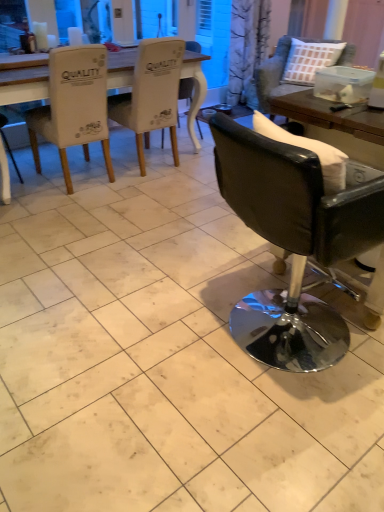
Identify the location of white fabric chair at center, which ranks as the 3th chair in right-to-left order. (193, 88).

Measure the distance between white fabric chair at center, the third chair when ordered from left to right, and camera.

white fabric chair at center, the third chair when ordered from left to right, is 10.55 feet from camera.

What is the approximate width of black leather chair at right, the fourth chair when ordered from left to right?

25.41 inches.

Describe the element at coordinates (269, 74) in the screenshot. I see `black leather chair at right, which ranks as the 1th chair in right-to-left order` at that location.

You are a GUI agent. You are given a task and a screenshot of the screen. Output one action in this format:
    pyautogui.click(x=<x>, y=<y>)
    Task: Click on the white fabric chair at center, the third chair when ordered from left to right
    
    Given the screenshot: What is the action you would take?
    pyautogui.click(x=193, y=88)

Based on the photo, considering the relative sizes of white fabric chair at upper left, the fifth chair viewed from the right, and white fabric chair at upper left, arranged as the 4th chair when viewed from the right, in the image provided, is white fabric chair at upper left, the fifth chair viewed from the right, shorter than white fabric chair at upper left, arranged as the 4th chair when viewed from the right,?

Correct, white fabric chair at upper left, the fifth chair viewed from the right, is not as tall as white fabric chair at upper left, arranged as the 4th chair when viewed from the right.

Is point (43, 106) behind point (148, 60)?

Yes.

Based on the photo, is white fabric chair at upper left, the fifth chair viewed from the right, positioned far away from white fabric chair at upper left, arranged as the 4th chair when viewed from the right?

white fabric chair at upper left, the fifth chair viewed from the right, is actually quite close to white fabric chair at upper left, arranged as the 4th chair when viewed from the right.

Is white fabric chair at center, the third chair when ordered from left to right, outside of white fabric table at upper left?

white fabric chair at center, the third chair when ordered from left to right, lies outside white fabric table at upper left's area.

From the image's perspective, who appears lower, white fabric chair at center, the third chair when ordered from left to right, or white fabric table at upper left?

white fabric chair at center, the third chair when ordered from left to right.

Between white fabric chair at center, which ranks as the 3th chair in right-to-left order, and white fabric table at upper left, which one appears on the left side from the viewer's perspective?

From the viewer's perspective, white fabric table at upper left appears more on the left side.

Considering the positions of points (194, 134) and (107, 87), is point (194, 134) farther from camera compared to point (107, 87)?

Yes.

In the image, is white fabric chair at upper left, arranged as the 4th chair when viewed from the right, positioned in front of or behind white fabric table at upper left?

white fabric chair at upper left, arranged as the 4th chair when viewed from the right, is positioned closer to the viewer than white fabric table at upper left.

How different are the orientations of white fabric chair at upper left, arranged as the 4th chair when viewed from the right, and white fabric table at upper left in degrees?

There is a 180-degree angle between the facing directions of white fabric chair at upper left, arranged as the 4th chair when viewed from the right, and white fabric table at upper left.

Considering the relative sizes of white fabric chair at center, which ranks as the 3th chair in right-to-left order, and black leather chair at right, which ranks as the 1th chair in right-to-left order, in the image provided, is white fabric chair at center, which ranks as the 3th chair in right-to-left order, shorter than black leather chair at right, which ranks as the 1th chair in right-to-left order,?

Correct, white fabric chair at center, which ranks as the 3th chair in right-to-left order, is not as tall as black leather chair at right, which ranks as the 1th chair in right-to-left order.

In the scene shown: Which object is positioned more to the right, white fabric chair at center, the third chair when ordered from left to right, or black leather chair at right, which ranks as the 1th chair in right-to-left order?

black leather chair at right, which ranks as the 1th chair in right-to-left order.

Is white fabric chair at center, the third chair when ordered from left to right, aimed at black leather chair at right, which ranks as the 1th chair in right-to-left order?

No, white fabric chair at center, the third chair when ordered from left to right, does not turn towards black leather chair at right, which ranks as the 1th chair in right-to-left order.

From the picture: Considering the relative sizes of white fabric chair at center, which ranks as the 3th chair in right-to-left order, and black leather chair at right, the 5th chair from the left, in the image provided, is white fabric chair at center, which ranks as the 3th chair in right-to-left order, smaller than black leather chair at right, the 5th chair from the left,?

Yes.

Are white fabric chair at upper left, which is counted as the second chair, starting from the left, and white fabric chair at upper left, the fifth chair viewed from the right, far apart?

white fabric chair at upper left, which is counted as the second chair, starting from the left, is near white fabric chair at upper left, the fifth chair viewed from the right, not far away.

Looking at this image, is white fabric chair at upper left, arranged as the 4th chair when viewed from the right, inside or outside of white fabric chair at upper left, the fifth chair viewed from the right?

white fabric chair at upper left, arranged as the 4th chair when viewed from the right, is outside white fabric chair at upper left, the fifth chair viewed from the right.

Is white fabric chair at upper left, arranged as the 4th chair when viewed from the right, looking in the opposite direction of white fabric chair at upper left, which ranks as the 1th chair in left-to-right order?

No, white fabric chair at upper left, arranged as the 4th chair when viewed from the right,'s orientation is not away from white fabric chair at upper left, which ranks as the 1th chair in left-to-right order.

From a real-world perspective, does white fabric chair at upper left, arranged as the 4th chair when viewed from the right, sit lower than white fabric chair at upper left, which ranks as the 1th chair in left-to-right order?

No, from a real-world perspective, white fabric chair at upper left, arranged as the 4th chair when viewed from the right, is not below white fabric chair at upper left, which ranks as the 1th chair in left-to-right order.

From a real-world perspective, which is physically above, black leather chair at right, acting as the 2th chair starting from the right, or white fabric chair at upper left, the fifth chair viewed from the right?

white fabric chair at upper left, the fifth chair viewed from the right, from a real-world perspective.

Would you say black leather chair at right, the fourth chair when ordered from left to right, is outside white fabric chair at upper left, the fifth chair viewed from the right?

Yes, black leather chair at right, the fourth chair when ordered from left to right, is outside of white fabric chair at upper left, the fifth chair viewed from the right.

From the image's perspective, is black leather chair at right, acting as the 2th chair starting from the right, positioned above or below white fabric chair at upper left, which ranks as the 1th chair in left-to-right order?

Clearly, from the image's perspective, black leather chair at right, acting as the 2th chair starting from the right, is below white fabric chair at upper left, which ranks as the 1th chair in left-to-right order.

Based on the photo, considering the relative sizes of black leather chair at right, acting as the 2th chair starting from the right, and white fabric chair at upper left, which ranks as the 1th chair in left-to-right order, in the image provided, is black leather chair at right, acting as the 2th chair starting from the right, taller than white fabric chair at upper left, which ranks as the 1th chair in left-to-right order,?

In fact, black leather chair at right, acting as the 2th chair starting from the right, may be shorter than white fabric chair at upper left, which ranks as the 1th chair in left-to-right order.

Which object is wider, black leather chair at right, the 5th chair from the left, or white fabric chair at upper left, which ranks as the 1th chair in left-to-right order?

Wider between the two is black leather chair at right, the 5th chair from the left.

From the image's perspective, is black leather chair at right, the 5th chair from the left, located above white fabric chair at upper left, the fifth chair viewed from the right?

Yes, from the image's perspective, black leather chair at right, the 5th chair from the left, is over white fabric chair at upper left, the fifth chair viewed from the right.

Can you tell me how much black leather chair at right, which ranks as the 1th chair in right-to-left order, and white fabric chair at upper left, which ranks as the 1th chair in left-to-right order, differ in facing direction?

112 degrees separate the facing orientations of black leather chair at right, which ranks as the 1th chair in right-to-left order, and white fabric chair at upper left, which ranks as the 1th chair in left-to-right order.

Consider the image. From a real-world perspective, does black leather chair at right, which ranks as the 1th chair in right-to-left order, stand above white fabric chair at upper left, the fifth chair viewed from the right?

No, from a real-world perspective, black leather chair at right, which ranks as the 1th chair in right-to-left order, is not above white fabric chair at upper left, the fifth chair viewed from the right.

Identify the location of chair located above the white fabric chair at upper left, the fifth chair viewed from the right (from a real-world perspective). The height and width of the screenshot is (512, 384). (152, 94).

Starting from the white fabric table at upper left, which chair is the 1st one behind? Please provide its 2D coordinates.

[(193, 88)]

Estimate the real-world distances between objects in this image. Which object is closer to white fabric chair at upper left, which is counted as the second chair, starting from the left, black leather chair at right, the fourth chair when ordered from left to right, or white fabric chair at center, which ranks as the 3th chair in right-to-left order?

white fabric chair at center, which ranks as the 3th chair in right-to-left order, is closer to white fabric chair at upper left, which is counted as the second chair, starting from the left.

Which object lies nearer to the anchor point white fabric chair at center, which ranks as the 3th chair in right-to-left order, black leather chair at right, the fourth chair when ordered from left to right, or white fabric chair at upper left, which ranks as the 1th chair in left-to-right order?

white fabric chair at upper left, which ranks as the 1th chair in left-to-right order, is positioned closer to the anchor white fabric chair at center, which ranks as the 3th chair in right-to-left order.

Based on their spatial positions, is black leather chair at right, which ranks as the 1th chair in right-to-left order, or white fabric chair at center, the third chair when ordered from left to right, closer to white fabric chair at upper left, which is counted as the second chair, starting from the left?

white fabric chair at center, the third chair when ordered from left to right.

From the image, which object appears to be farther from white fabric chair at center, the third chair when ordered from left to right, black leather chair at right, the fourth chair when ordered from left to right, or white fabric table at upper left?

Based on the image, black leather chair at right, the fourth chair when ordered from left to right, appears to be further to white fabric chair at center, the third chair when ordered from left to right.

Which object lies further to the anchor point black leather chair at right, the 5th chair from the left, white fabric chair at upper left, which ranks as the 1th chair in left-to-right order, or black leather chair at right, acting as the 2th chair starting from the right?

Based on the image, black leather chair at right, acting as the 2th chair starting from the right, appears to be further to black leather chair at right, the 5th chair from the left.

From the image, which object appears to be farther from black leather chair at right, the fourth chair when ordered from left to right, white fabric chair at center, the third chair when ordered from left to right, or white fabric chair at upper left, the fifth chair viewed from the right?

white fabric chair at center, the third chair when ordered from left to right, is further to black leather chair at right, the fourth chair when ordered from left to right.

Looking at the image, which one is located further to white fabric chair at upper left, arranged as the 4th chair when viewed from the right, white fabric chair at upper left, which ranks as the 1th chair in left-to-right order, or white fabric chair at center, the third chair when ordered from left to right?

The object further to white fabric chair at upper left, arranged as the 4th chair when viewed from the right, is white fabric chair at upper left, which ranks as the 1th chair in left-to-right order.

Considering their positions, is white fabric table at upper left positioned further to black leather chair at right, acting as the 2th chair starting from the right, than white fabric chair at upper left, the fifth chair viewed from the right?

white fabric table at upper left is further to black leather chair at right, acting as the 2th chair starting from the right.

Image resolution: width=384 pixels, height=512 pixels. Identify the location of chair between white fabric chair at upper left, the fifth chair viewed from the right, and white fabric chair at center, the third chair when ordered from left to right, along the z-axis. (152, 94).

The image size is (384, 512). In order to click on chair positioned between black leather chair at right, acting as the 2th chair starting from the right, and white fabric chair at upper left, which is counted as the second chair, starting from the left, from near to far in this screenshot , I will do `click(73, 106)`.

Locate an element on the screen. This screenshot has height=512, width=384. table positioned between white fabric chair at upper left, which ranks as the 1th chair in left-to-right order, and white fabric chair at center, the third chair when ordered from left to right, from near to far is located at coordinates (23, 84).

Find the location of `table between white fabric chair at upper left, the fifth chair viewed from the right, and black leather chair at right, which ranks as the 1th chair in right-to-left order`. table between white fabric chair at upper left, the fifth chair viewed from the right, and black leather chair at right, which ranks as the 1th chair in right-to-left order is located at coordinates (23, 84).